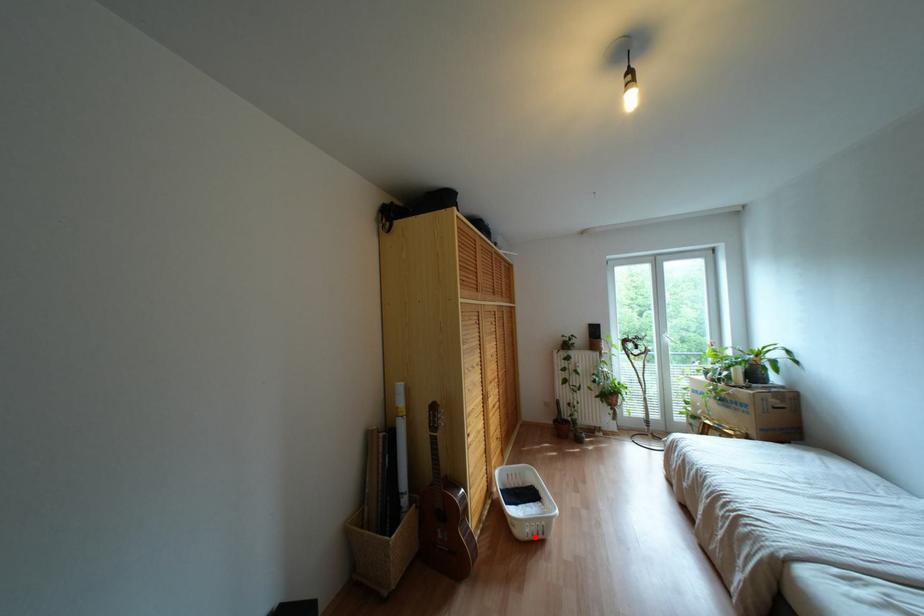
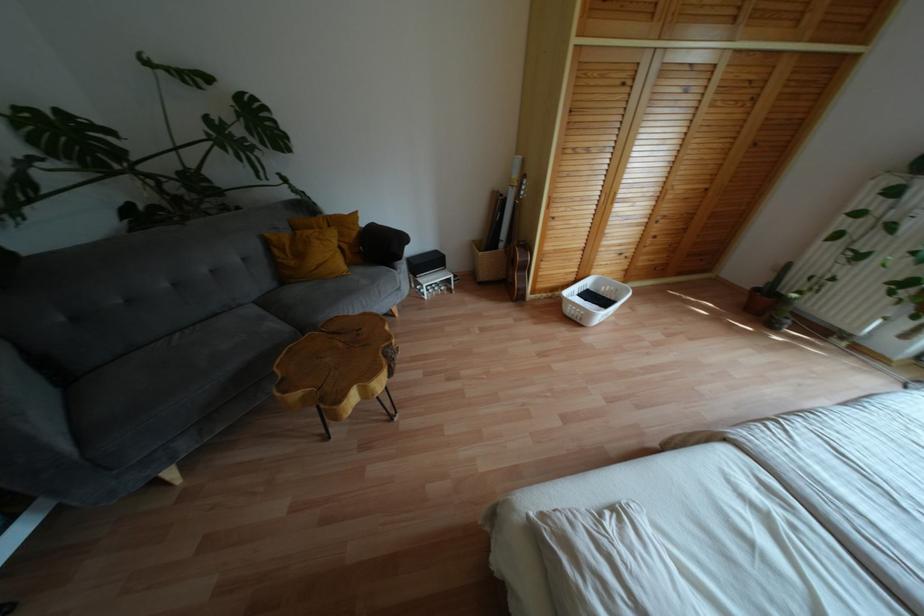
In the second image, find the point that corresponds to the highlighted location in the first image.

(573, 318)